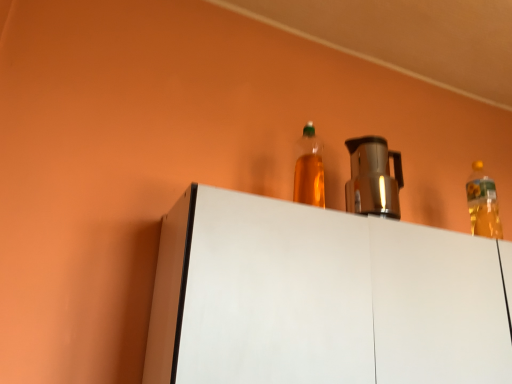
Question: Does point (355, 160) appear closer or farther from the camera than point (498, 215)?

Choices:
 (A) closer
 (B) farther

Answer: (B)

Question: Considering the positions of metallic silver coffee pot at center and translucent yellow bottle at upper right, which is the 2th bottle in left-to-right order, in the image, is metallic silver coffee pot at center taller or shorter than translucent yellow bottle at upper right, which is the 2th bottle in left-to-right order,?

Choices:
 (A) tall
 (B) short

Answer: (B)

Question: Which of these objects is positioned closest to the metallic silver coffee pot at center?

Choices:
 (A) white matte cabinet at upper center
 (B) translucent yellow bottle at upper right, acting as the first bottle starting from the right
 (C) translucent plastic bottle at upper center, the 2th bottle viewed from the back

Answer: (B)

Question: Which object is the farthest from the white matte cabinet at upper center?

Choices:
 (A) translucent plastic bottle at upper center, which is the 1th bottle from front to back
 (B) translucent yellow bottle at upper right, which is the 2th bottle in left-to-right order
 (C) metallic silver coffee pot at center

Answer: (C)